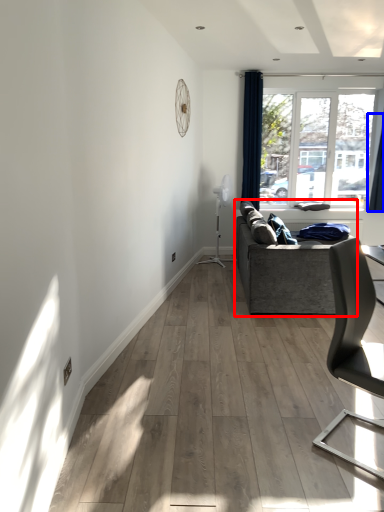
Question: Which point is further to the camera, studio couch (highlighted by a red box) or curtain (highlighted by a blue box)?

Choices:
 (A) studio couch
 (B) curtain

Answer: (B)